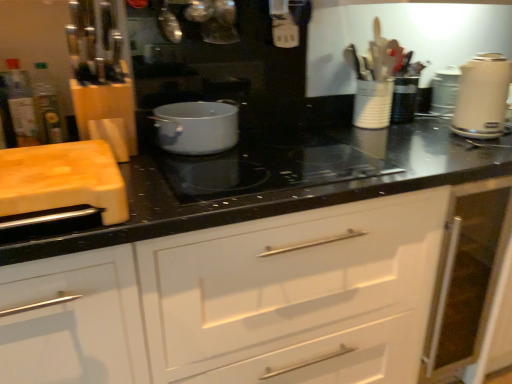
Question: From a real-world perspective, is white ceramic utensil holder at upper right, which ranks as the 2th appliance in front-to-back order, positioned above or below metallic silver kettle at upper center, positioned as the 1th appliance in front-to-back order?

Choices:
 (A) below
 (B) above

Answer: (A)

Question: Does point (369, 127) appear closer or farther from the camera than point (163, 11)?

Choices:
 (A) farther
 (B) closer

Answer: (A)

Question: Estimate the real-world distances between objects in this image. Which object is farther from the white glossy drawer at center?

Choices:
 (A) wooden cutting board at left
 (B) white ceramic utensil holder at upper right, marked as the second appliance in a left-to-right arrangement
 (C) metallic silver kettle at upper center, positioned as the third appliance in back-to-front order
 (D) translucent plastic bottle at left, which appears as the 1th bottle when viewed from the left
 (E) white glossy electric kettle at right, which appears as the 2th kitchen appliance when viewed from the left

Answer: (C)

Question: Estimate the real-world distances between objects in this image. Which object is farther from the translucent plastic bottle at left, which appears as the 1th bottle when viewed from the left?

Choices:
 (A) white ceramic utensil holder at upper right, the second appliance positioned from the back
 (B) black glass cooktop at center
 (C) wooden cutting board at left
 (D) matte white pot at center, which appears as the second kitchen appliance when viewed from the right
 (E) metallic silver kettle at upper center, positioned as the 1th appliance in front-to-back order

Answer: (A)